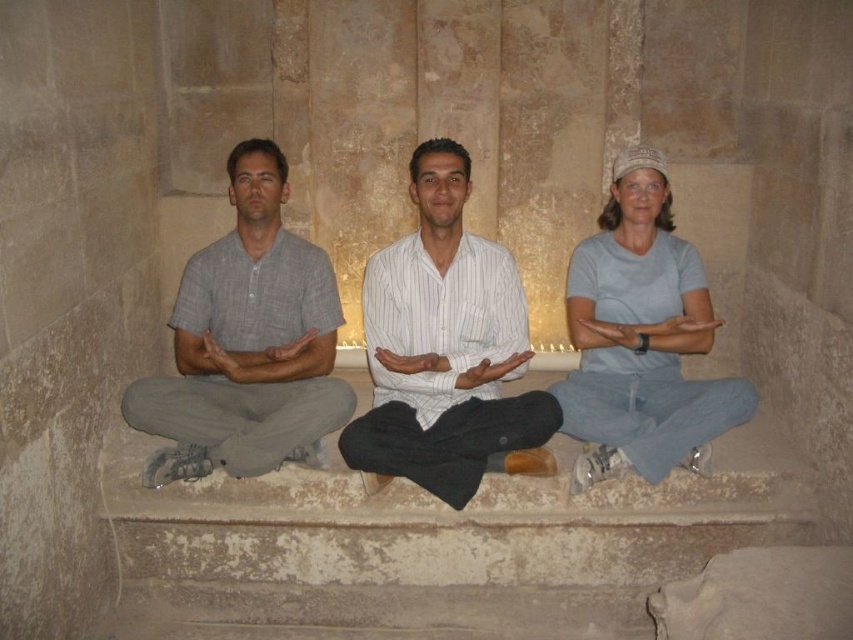
Question: Observing the image, what is the correct spatial positioning of gray cotton shirt at left in reference to light blue cotton shirt at center?

Choices:
 (A) above
 (B) below

Answer: (A)

Question: Which object is the farthest from the gray cotton shirt at left?

Choices:
 (A) light blue cotton shirt at center
 (B) white striped shirt at center

Answer: (A)

Question: Does white striped shirt at center have a greater width compared to gray cotton shirt at left?

Choices:
 (A) no
 (B) yes

Answer: (A)

Question: Does gray cotton shirt at left come in front of light blue cotton shirt at center?

Choices:
 (A) yes
 (B) no

Answer: (B)

Question: Which of the following is the farthest from the observer?

Choices:
 (A) light blue cotton shirt at center
 (B) white striped shirt at center

Answer: (A)

Question: Which of the following is the closest to the observer?

Choices:
 (A) white striped shirt at center
 (B) light blue cotton shirt at center

Answer: (A)